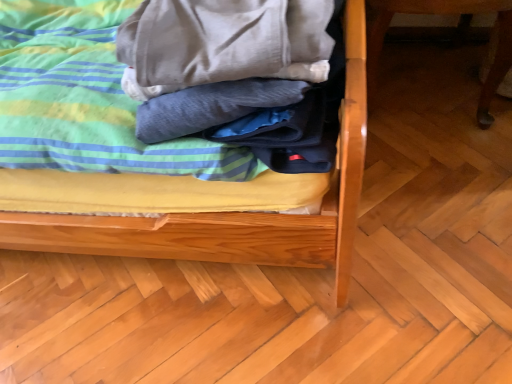
Question: Is soft cotton bed at center outside of wooden table leg at right?

Choices:
 (A) no
 (B) yes

Answer: (B)

Question: Is soft cotton bed at center closer to the viewer compared to wooden table leg at right?

Choices:
 (A) yes
 (B) no

Answer: (A)

Question: Considering the relative positions of soft cotton bed at center and wooden table leg at right in the image provided, is soft cotton bed at center to the right of wooden table leg at right from the viewer's perspective?

Choices:
 (A) no
 (B) yes

Answer: (A)

Question: Is wooden table leg at right at the back of soft cotton bed at center?

Choices:
 (A) no
 (B) yes

Answer: (A)

Question: Considering the relative sizes of soft cotton bed at center and wooden table leg at right in the image provided, is soft cotton bed at center shorter than wooden table leg at right?

Choices:
 (A) yes
 (B) no

Answer: (B)

Question: From the image's perspective, is soft cotton bed at center located beneath wooden table leg at right?

Choices:
 (A) no
 (B) yes

Answer: (B)

Question: Is wooden table leg at right in contact with soft cotton bed at center?

Choices:
 (A) no
 (B) yes

Answer: (A)

Question: Is soft cotton bed at center at the back of wooden table leg at right?

Choices:
 (A) no
 (B) yes

Answer: (A)

Question: Can you confirm if wooden table leg at right is positioned to the left of soft cotton bed at center?

Choices:
 (A) yes
 (B) no

Answer: (B)

Question: Considering the relative positions of wooden table leg at right and soft cotton bed at center in the image provided, is wooden table leg at right in front of soft cotton bed at center?

Choices:
 (A) no
 (B) yes

Answer: (A)

Question: Is wooden table leg at right wider than soft cotton bed at center?

Choices:
 (A) yes
 (B) no

Answer: (B)

Question: Considering the relative sizes of wooden table leg at right and soft cotton bed at center in the image provided, is wooden table leg at right shorter than soft cotton bed at center?

Choices:
 (A) no
 (B) yes

Answer: (B)

Question: Is soft cotton blanket at center smaller than wooden table leg at right?

Choices:
 (A) no
 (B) yes

Answer: (B)